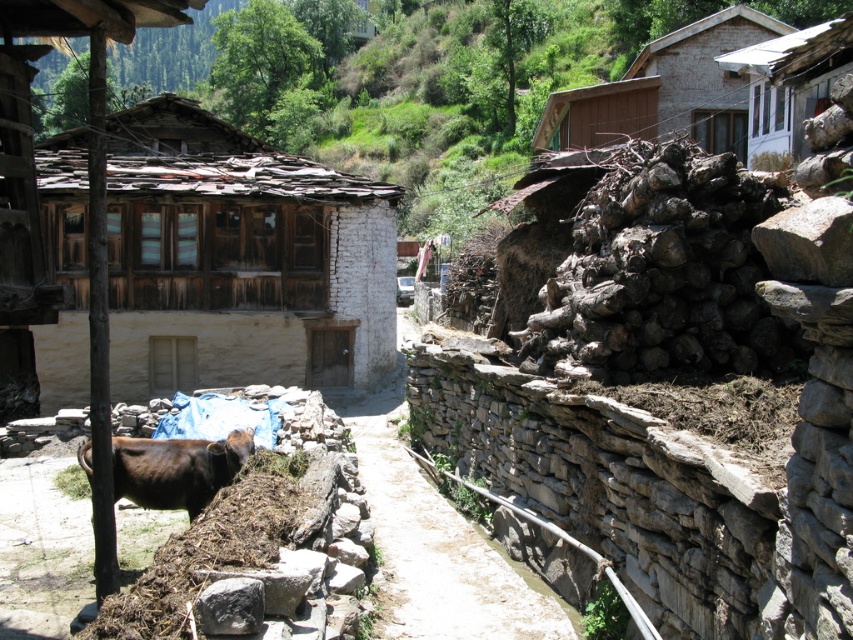
You are a hiker standing on the dirt path at center and want to take a photo of the weathered wood hut at left. To get the best angle, you need to know if the hut is taller than the path. Can you confirm?

The weathered wood hut at left has a greater height compared to the dirt path at center, so yes, the hut is taller than the path.

You are a hiker who wants to take a photo of the brown wooden hut at upper right and the wooden shingles hut at upper right. Which one is located higher up the mountain?

The brown wooden hut at upper right is positioned over the wooden shingles hut at upper right, so it is higher up the mountain.